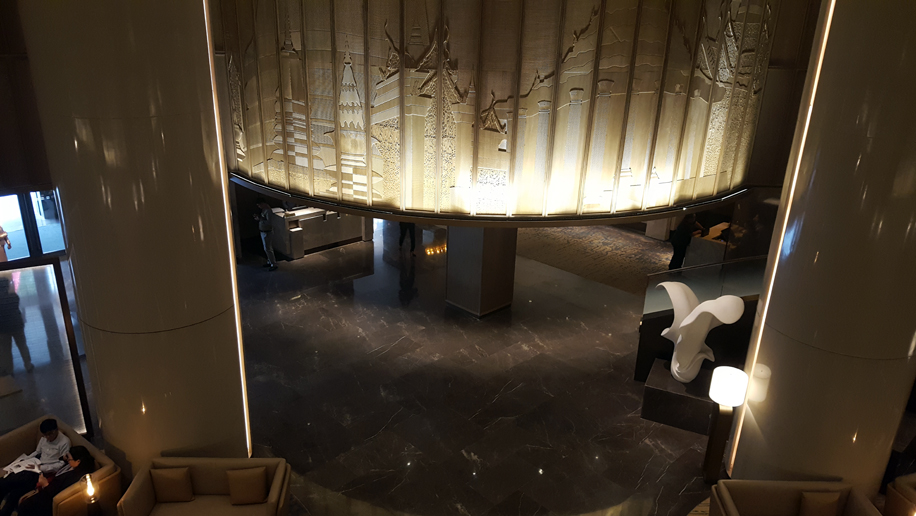
This screenshot has width=916, height=516. I want to click on couch, so click(227, 491), click(769, 499), click(104, 474).